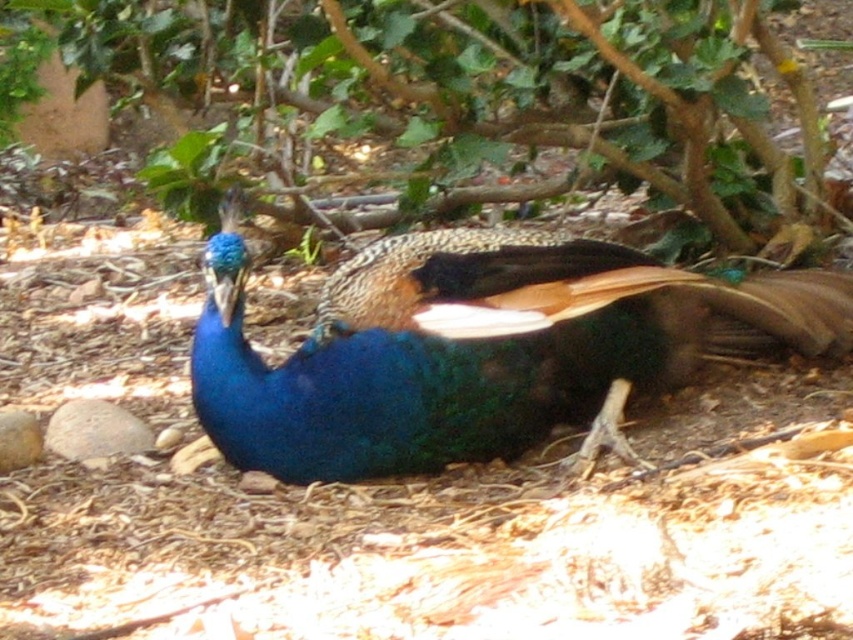
You are a birdwatcher observing the scene. You notice the shiny blue peacock at center and the green leafy tree at upper center. Which object is positioned higher in the image?

The green leafy tree at upper center is positioned higher than the shiny blue peacock at center in the image.

You are a birdwatcher observing the peacock from a distance. You notice two points marked in the image. The first point is at coordinates point (64,13) and the second point is at point (231,356). Which point is closer to your current position?

Point (231,356) is closer to your current position because the description states that point (64,13) is behind point (231,356).

Based on the photo, you are an artist sketching the scene. You want to ensure the green leafy tree at upper center and the shiny blue peacock at center are proportionally accurate. Which object should you draw wider in your sketch?

The green leafy tree at upper center should be drawn wider than the shiny blue peacock at center because its width surpasses the peacock.